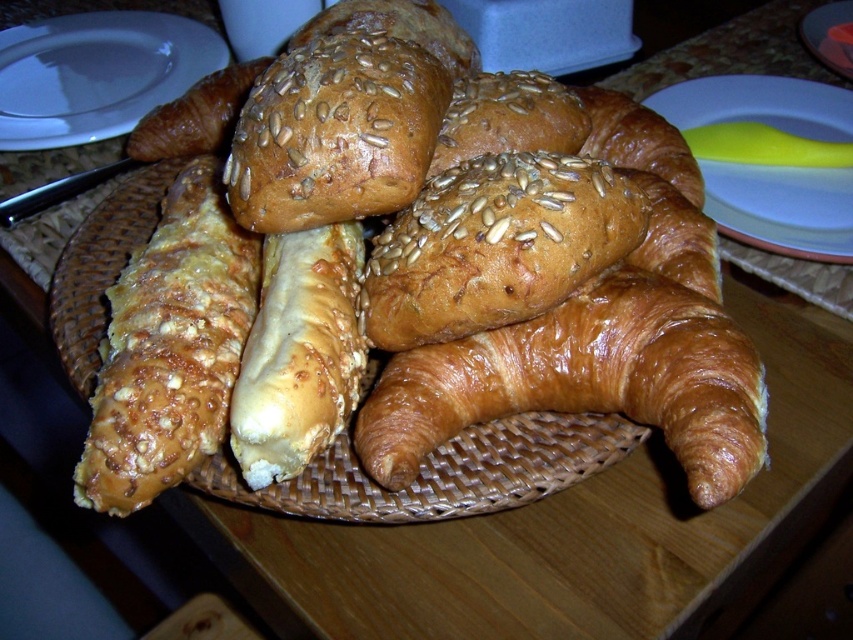
Does shiny golden croissant at center have a lesser height compared to slightly toasted croissant at center?

Incorrect, shiny golden croissant at center's height does not fall short of slightly toasted croissant at center's.

Can you confirm if shiny golden croissant at center is positioned above slightly toasted croissant at center?

No.

You are a GUI agent. You are given a task and a screenshot of the screen. Output one action in this format:
    pyautogui.click(x=<x>, y=<y>)
    Task: Click on the shiny golden croissant at center
    This screenshot has width=853, height=640.
    Given the screenshot: What is the action you would take?
    pyautogui.click(x=585, y=381)

Who is shorter, sesame seed-covered bread roll at center or slightly toasted croissant at center?

slightly toasted croissant at center is shorter.

Who is more distant from viewer, [402,61] or [175,145]?

Point [175,145]

Locate an element on the screen. The width and height of the screenshot is (853, 640). sesame seed-covered bread roll at center is located at coordinates (335, 132).

The width and height of the screenshot is (853, 640). I want to click on sesame seed-covered bread roll at center, so click(x=335, y=132).

Who is taller, white ceramic plate at upper left or white glossy plate at upper center?

Standing taller between the two is white ceramic plate at upper left.

Is white ceramic plate at upper left below white glossy plate at upper center?

Indeed, white ceramic plate at upper left is positioned under white glossy plate at upper center.

Does point (25, 147) come in front of point (809, 33)?

That is True.

Locate an element on the screen. This screenshot has height=640, width=853. white ceramic plate at upper left is located at coordinates (96, 74).